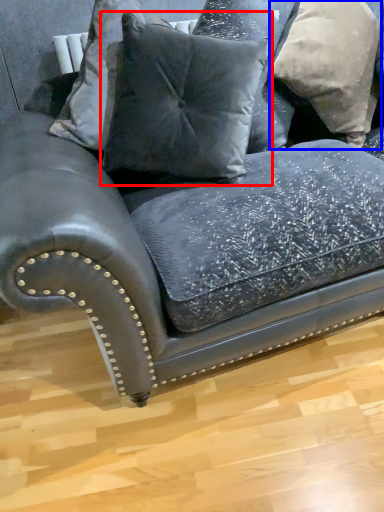
Question: Which object is closer to the camera taking this photo, pillow (highlighted by a red box) or pillow (highlighted by a blue box)?

Choices:
 (A) pillow
 (B) pillow

Answer: (A)